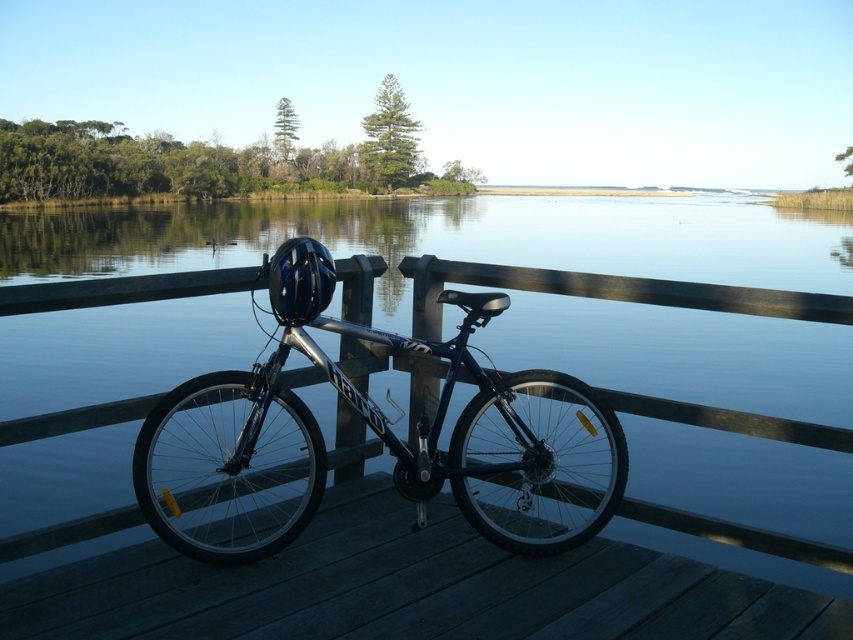
Question: Among these objects, which one is farthest from the camera?

Choices:
 (A) dark wood dock at center
 (B) shiny metallic bicycle at center

Answer: (B)

Question: Which point is farther to the camera?

Choices:
 (A) (486, 413)
 (B) (699, 572)

Answer: (A)

Question: Can you confirm if transparent water at center is positioned below dark wood dock at center?

Choices:
 (A) yes
 (B) no

Answer: (B)

Question: Is dark wood dock at center smaller than shiny metallic bicycle at center?

Choices:
 (A) yes
 (B) no

Answer: (A)

Question: Is transparent water at center above shiny metallic bicycle at center?

Choices:
 (A) yes
 (B) no

Answer: (A)

Question: Which point is farther to the camera?

Choices:
 (A) (96, 433)
 (B) (271, 573)

Answer: (A)